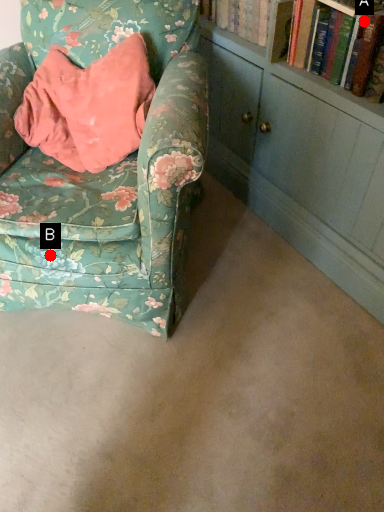
Question: Two points are circled on the image, labeled by A and B beside each circle. Which point is closer to the camera?

Choices:
 (A) A is closer
 (B) B is closer

Answer: (A)